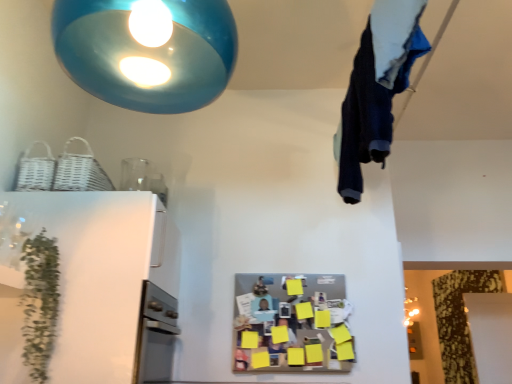
Question: Is there a large distance between green leafy plant at left and dark blue fabric at upper right?

Choices:
 (A) yes
 (B) no

Answer: (A)

Question: Can you confirm if green leafy plant at left is bigger than dark blue fabric at upper right?

Choices:
 (A) no
 (B) yes

Answer: (A)

Question: Would you say dark blue fabric at upper right is part of green leafy plant at left's contents?

Choices:
 (A) yes
 (B) no

Answer: (B)

Question: From the image's perspective, does green leafy plant at left appear lower than dark blue fabric at upper right?

Choices:
 (A) no
 (B) yes

Answer: (B)

Question: Does green leafy plant at left appear on the left side of dark blue fabric at upper right?

Choices:
 (A) no
 (B) yes

Answer: (B)

Question: From a real-world perspective, is green leafy plant at left located higher than dark blue fabric at upper right?

Choices:
 (A) yes
 (B) no

Answer: (B)

Question: Can you confirm if white glossy refrigerator at left is smaller than glossy blue pendant light at upper center?

Choices:
 (A) yes
 (B) no

Answer: (B)

Question: Is there a large distance between white glossy refrigerator at left and glossy blue pendant light at upper center?

Choices:
 (A) no
 (B) yes

Answer: (B)

Question: From the image's perspective, is white glossy refrigerator at left on glossy blue pendant light at upper center?

Choices:
 (A) yes
 (B) no

Answer: (B)

Question: From a real-world perspective, is white glossy refrigerator at left positioned over glossy blue pendant light at upper center based on gravity?

Choices:
 (A) no
 (B) yes

Answer: (A)

Question: Is white glossy refrigerator at left closer to camera compared to glossy blue pendant light at upper center?

Choices:
 (A) no
 (B) yes

Answer: (A)

Question: Is white glossy refrigerator at left facing towards glossy blue pendant light at upper center?

Choices:
 (A) yes
 (B) no

Answer: (B)

Question: Is white glossy refrigerator at left located outside green leafy plant at left?

Choices:
 (A) yes
 (B) no

Answer: (A)